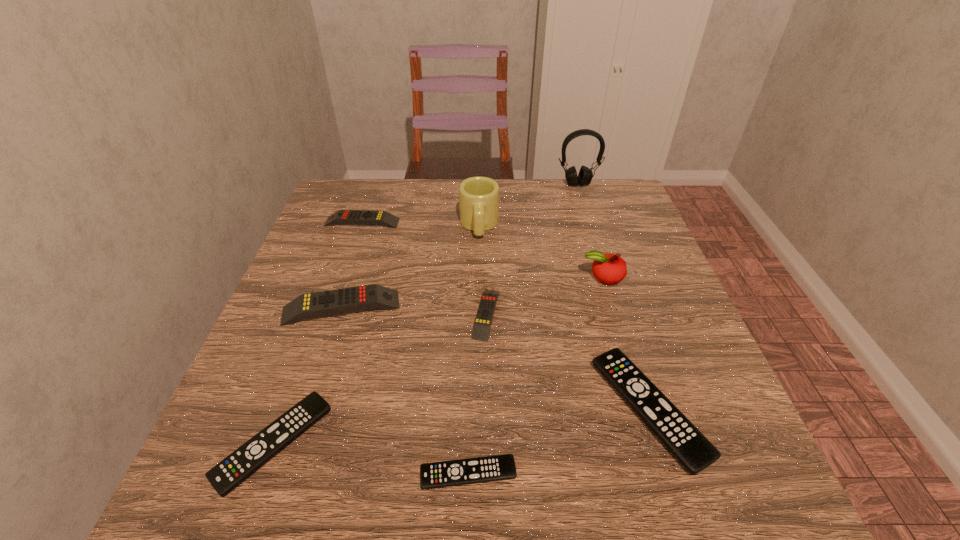
This screenshot has width=960, height=540. What are the coordinates of `vacant area between the farthest remote control and the rightmost black remote control` in the screenshot? It's located at (505, 316).

Identify which object is located as the third nearest to the headset. Please provide its 2D coordinates. Your answer should be formatted as a tuple, i.e. [(x, y)], where the tuple contains the x and y coordinates of a point satisfying the conditions above.

[(357, 217)]

The image size is (960, 540). Find the location of `the eighth closest object to the shortest object`. the eighth closest object to the shortest object is located at coordinates (585, 175).

Identify which remote control is located as the fourth nearest to the farthest yellow remote control. Please provide its 2D coordinates. Your answer should be formatted as a tuple, i.e. [(x, y)], where the tuple contains the x and y coordinates of a point satisfying the conditions above.

[(690, 447)]

Identify which remote control is located as the sixth nearest to the farthest object. Please provide its 2D coordinates. Your answer should be formatted as a tuple, i.e. [(x, y)], where the tuple contains the x and y coordinates of a point satisfying the conditions above.

[(225, 476)]

Where is `yellow remote control that is the second closest to the mug`? Image resolution: width=960 pixels, height=540 pixels. yellow remote control that is the second closest to the mug is located at coordinates (484, 317).

At what (x,y) coordinates should I click in order to perform the action: click on yellow remote control that can be found as the second closest to the rightmost remote control. Please return your answer as a coordinate pair (x, y). The height and width of the screenshot is (540, 960). Looking at the image, I should click on (310, 305).

Identify the location of black remote control that is the third closest to the tallest remote control. tap(690, 447).

This screenshot has width=960, height=540. I want to click on black remote control that stands as the second closest to the biggest black remote control, so click(225, 476).

Locate an element on the screen. free space that satisfies the following two spatial constraints: 1. with the handle on the side of the eighth shortest object; 2. on the left side of the third tallest object is located at coordinates (479, 277).